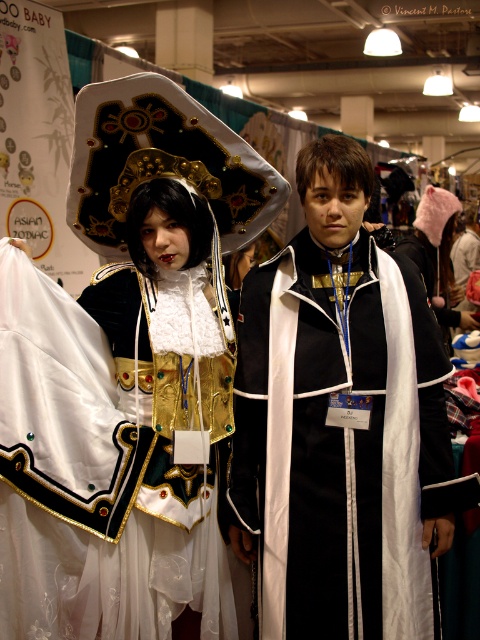
You are a photographer at the event and want to place a spotlight exactly at the center of the shiny gold armor at center. According to the coordinates provided, where should you aim the spotlight?

The spotlight should be aimed at point (119, 436), as that is the exact position of the shiny gold armor at center.

You are organizing a photo shoot and need to place the shiny gold armor at center and the matte black coat at center side by side. Given their widths, which object should be placed first if you want to ensure both fit within a 1.5 meter wide backdrop?

The shiny gold armor at center has a smaller width than the matte black coat at center. To ensure both fit within the 1.5 meter backdrop, place the wider matte black coat at center first, then position the narrower shiny gold armor at center next to it.

In the scene shown: You are a photographer at the event and need to position the two central subjects so that their heights appear balanced in the photo. Given that the shiny gold armor at center is shorter than the matte black coat at center, how should you adjust their positions to achieve this balance?

To balance their heights, place the shiny gold armor at center slightly closer to the camera and the matte black coat at center a bit farther back. This adjustment will visually reduce the height difference between the two subjects.